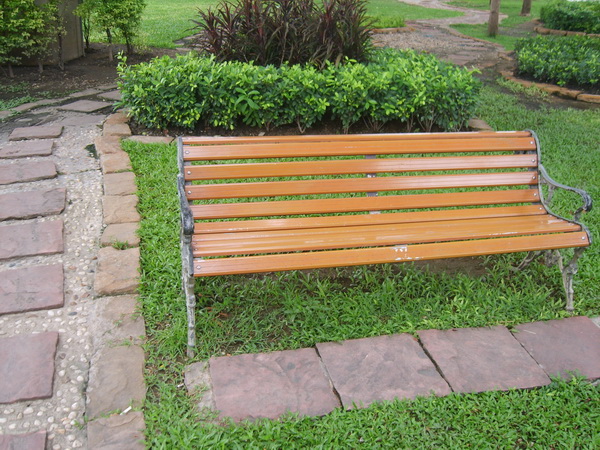
Find the location of a particular element. This screenshot has width=600, height=450. bench is located at coordinates (327, 204).